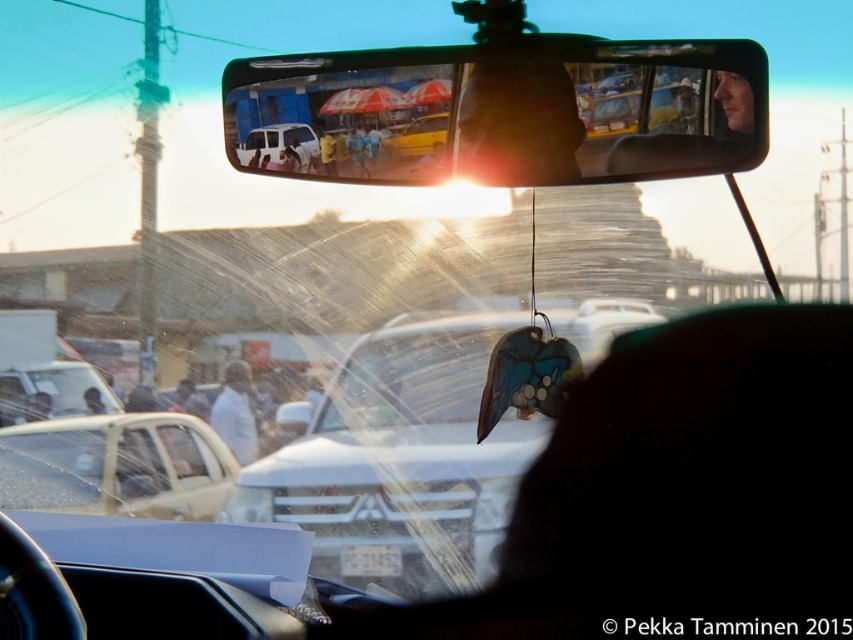
Question: Based on their relative distances, which object is farther from the white glossy car at center?

Choices:
 (A) yellow fabric umbrella at upper center
 (B) white matte car at left
 (C) clear plastic mirror at upper center

Answer: (A)

Question: Is white matte truck at left below light brown leather jacket at center?

Choices:
 (A) yes
 (B) no

Answer: (A)

Question: Does white plastic license plate at center appear under light brown leather jacket at center?

Choices:
 (A) no
 (B) yes

Answer: (B)

Question: Estimate the real-world distances between objects in this image. Which object is farther from the white matte van at center?

Choices:
 (A) white matte car at left
 (B) clear plastic mirror at upper center
 (C) white matte truck at left
 (D) yellow fabric umbrella at upper center

Answer: (A)

Question: Does yellow fabric umbrella at upper center have a lesser width compared to light brown leather jacket at center?

Choices:
 (A) no
 (B) yes

Answer: (B)

Question: Which is nearer to the white matte truck at left?

Choices:
 (A) white matte van at center
 (B) clear plastic mirror at upper center
 (C) white glossy car at center
 (D) white matte shirt at center

Answer: (D)